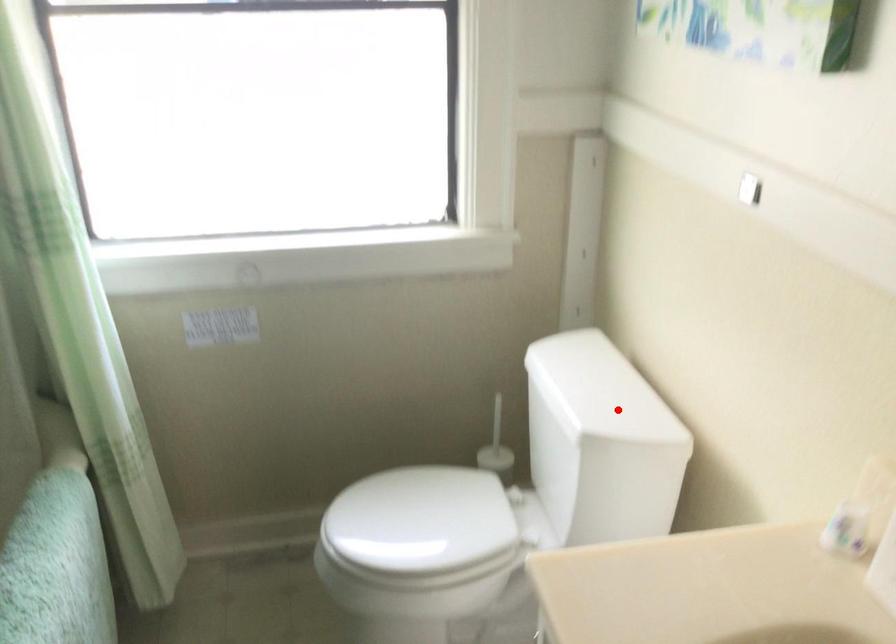
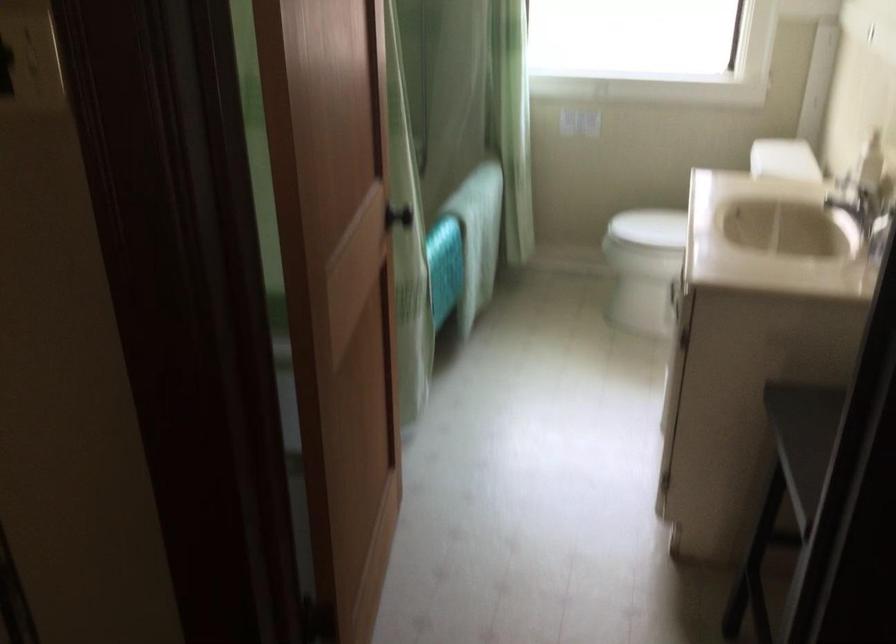
Where in the second image is the point corresponding to the highlighted location from the first image?

(784, 158)